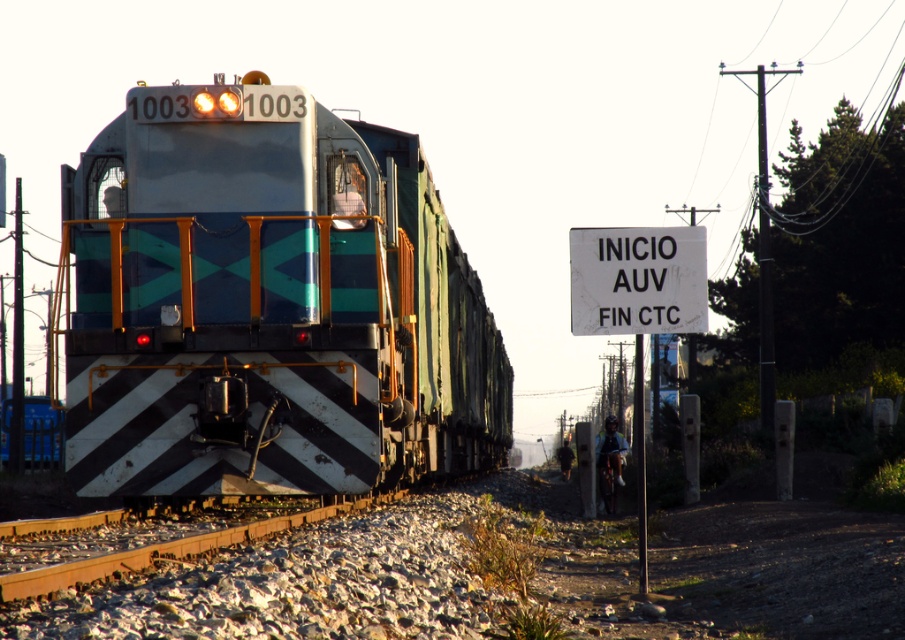
You are standing at point (576, 256) and want to walk to point (493, 342). Based on the railway scene described, will you need to move forward or backward to reach your destination?

Since point (493, 342) is behind point (576, 256), you will need to move backward to reach it.

You are a railway inspector checking the signs near the locomotive. You need to determine which sign is bigger between the white paper sign at center and the white plastic sign at upper right. Which one is larger?

The white paper sign at center is larger in size than the white plastic sign at upper right, so the white paper sign at center is bigger.